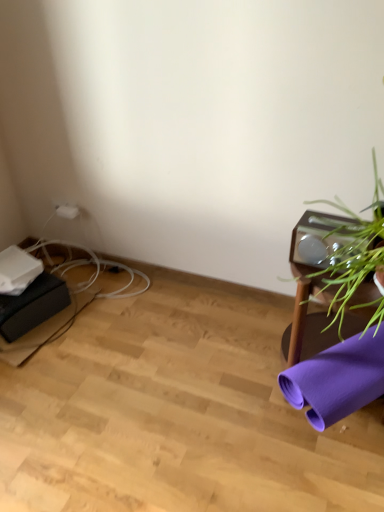
Question: Would you say white plastic plug at upper left is to the left or to the right of green leafy plant at right in the picture?

Choices:
 (A) right
 (B) left

Answer: (B)

Question: In terms of width, does white plastic plug at upper left look wider or thinner when compared to green leafy plant at right?

Choices:
 (A) thin
 (B) wide

Answer: (A)

Question: Which is farther from the green leafy plant at right?

Choices:
 (A) white plastic plug at upper left
 (B) purple fabric yoga mat at lower right

Answer: (A)

Question: Which of these objects is positioned closest to the green leafy plant at right?

Choices:
 (A) purple fabric yoga mat at lower right
 (B) white plastic plug at upper left

Answer: (A)